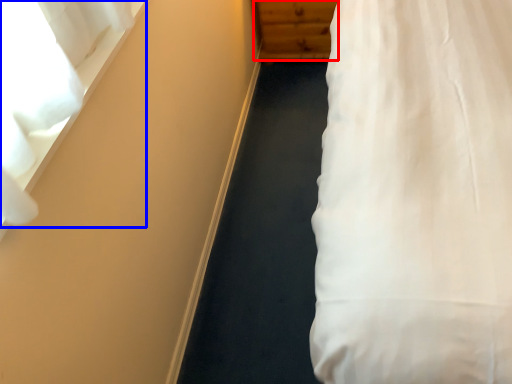
Question: Among these objects, which one is farthest to the camera, dresser (highlighted by a red box) or curtain (highlighted by a blue box)?

Choices:
 (A) dresser
 (B) curtain

Answer: (A)